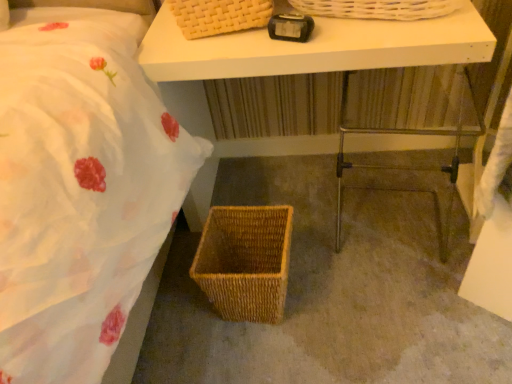
The image size is (512, 384). I want to click on free location to the left of black plastic alarm clock at upper center, so click(x=227, y=44).